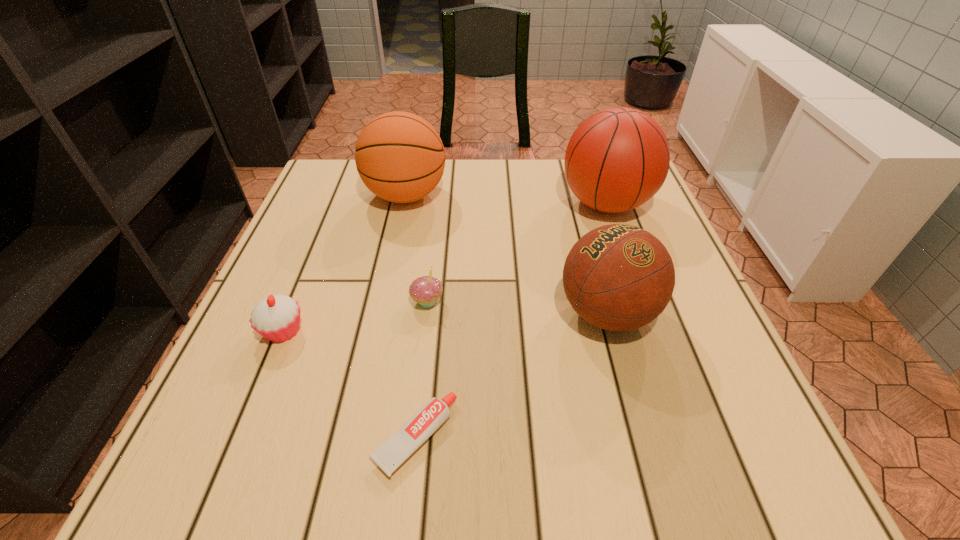
In the image, there is a desktop. Where is `vacant space at the near left corner`? The height and width of the screenshot is (540, 960). vacant space at the near left corner is located at coordinates (204, 436).

This screenshot has width=960, height=540. Find the location of `vacant space in between the leftmost object and the shortest object`. vacant space in between the leftmost object and the shortest object is located at coordinates (349, 384).

Where is `vacant space that is in between the nearest object and the leftmost basketball`? vacant space that is in between the nearest object and the leftmost basketball is located at coordinates (411, 316).

The width and height of the screenshot is (960, 540). I want to click on empty space that is in between the shortest object and the left cupcake, so click(x=349, y=384).

Image resolution: width=960 pixels, height=540 pixels. I want to click on vacant space that's between the right cupcake and the leftmost object, so click(x=355, y=316).

Locate an element on the screen. The width and height of the screenshot is (960, 540). free spot between the right cupcake and the left cupcake is located at coordinates (355, 316).

Where is `object that stands as the fourth closest to the right cupcake`? object that stands as the fourth closest to the right cupcake is located at coordinates (400, 157).

I want to click on the fourth closest object to the shortest object, so click(400, 157).

The height and width of the screenshot is (540, 960). What are the coordinates of `basketball that is the second closest to the leftmost basketball` in the screenshot? It's located at (618, 277).

The height and width of the screenshot is (540, 960). I want to click on basketball that can be found as the closest to the right cupcake, so click(x=618, y=277).